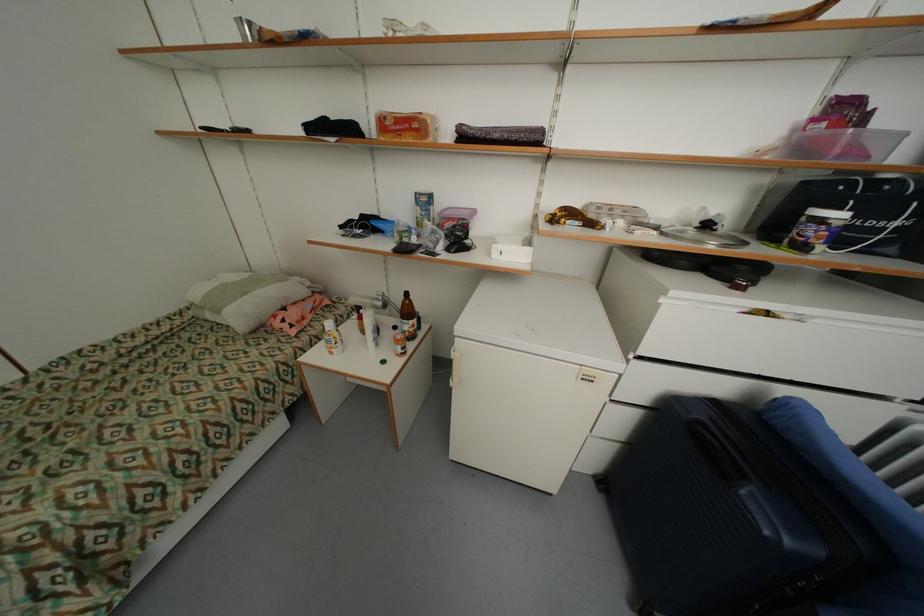
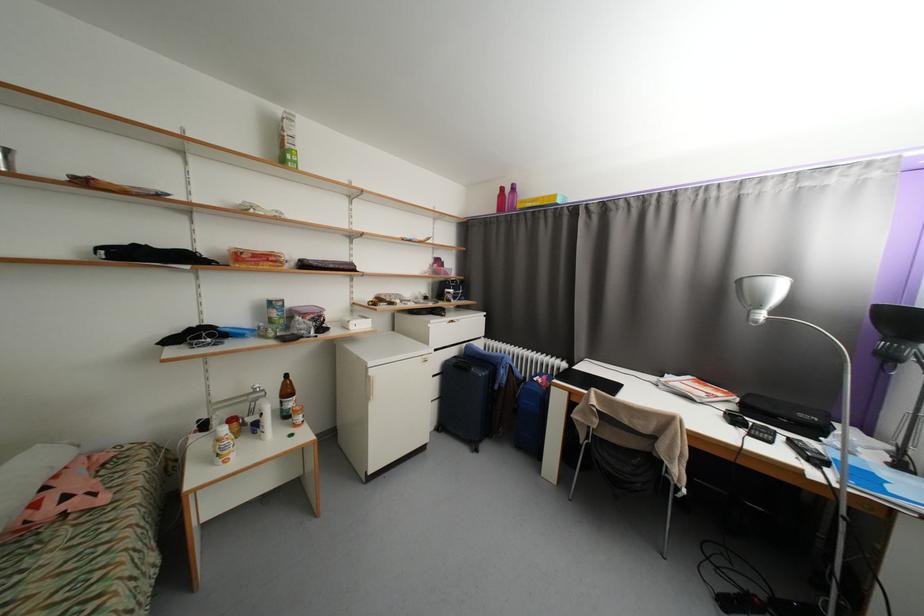
The point at [383,301] is marked in the first image. Where is the corresponding point in the second image?

(261, 392)